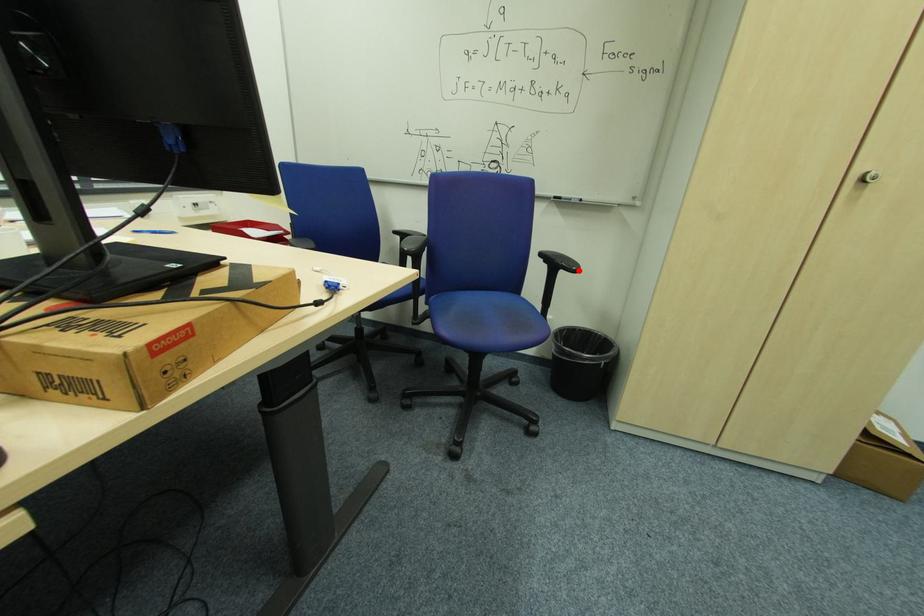
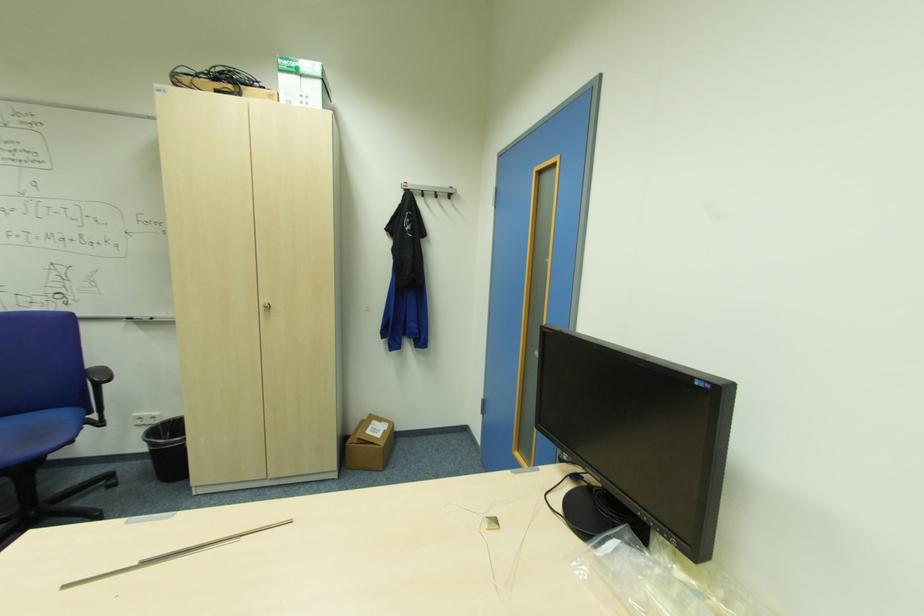
Where in the second image is the point corresponding to the highlighted location from the first image?

(110, 381)